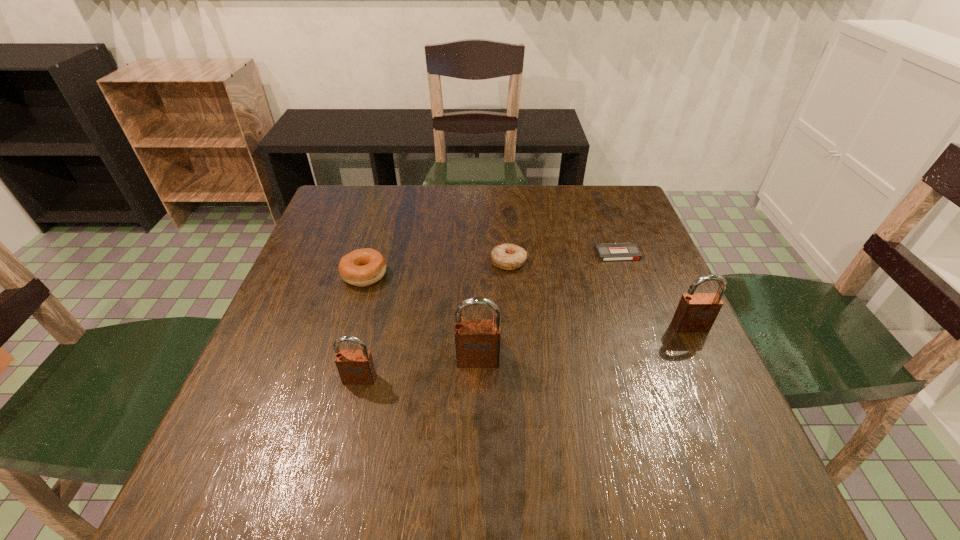
Find the location of a particular element. The width and height of the screenshot is (960, 540). blank space at the near edge of the desktop is located at coordinates (352, 423).

You are a GUI agent. You are given a task and a screenshot of the screen. Output one action in this format:
    pyautogui.click(x=<x>, y=<y>)
    Task: Click on the vacant space at the right edge of the desktop
    This screenshot has height=540, width=960.
    Given the screenshot: What is the action you would take?
    pyautogui.click(x=679, y=365)

This screenshot has height=540, width=960. Identify the location of free location at the far left corner of the desktop. (369, 194).

Find the location of a particular element. The height and width of the screenshot is (540, 960). vacant space at the far right corner of the desktop is located at coordinates (625, 186).

Find the location of a particular element. Image resolution: width=960 pixels, height=540 pixels. vacant space that is in between the rightmost padlock and the doughnut is located at coordinates (599, 294).

Where is `free area in between the videotape and the second padlock from left to right`? free area in between the videotape and the second padlock from left to right is located at coordinates (547, 307).

This screenshot has height=540, width=960. Identify the location of free spot between the second farthest padlock and the nearest object. pos(419,369).

Where is `free space that is in between the doughnut and the bagel`? free space that is in between the doughnut and the bagel is located at coordinates (437, 268).

Identify the location of free space between the second shortest padlock and the second farthest padlock. (584, 343).

This screenshot has width=960, height=540. What are the coordinates of `free space between the bagel and the second padlock from right to left` in the screenshot? It's located at (421, 318).